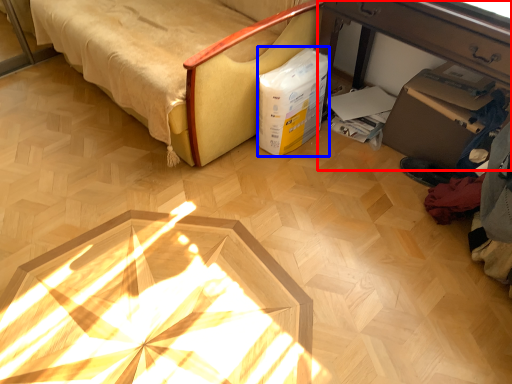
Question: Which object is closer to the camera taking this photo, table (highlighted by a red box) or box (highlighted by a blue box)?

Choices:
 (A) table
 (B) box

Answer: (A)